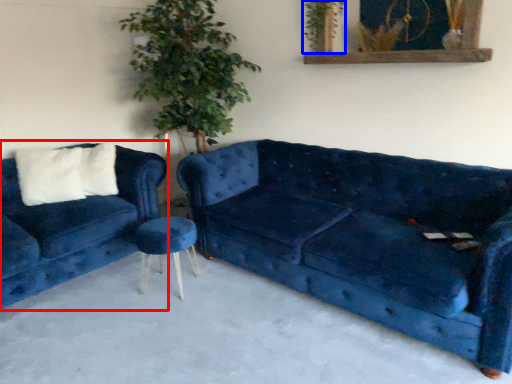
Question: Which object is closer to the camera taking this photo, studio couch (highlighted by a red box) or plant (highlighted by a blue box)?

Choices:
 (A) studio couch
 (B) plant

Answer: (A)